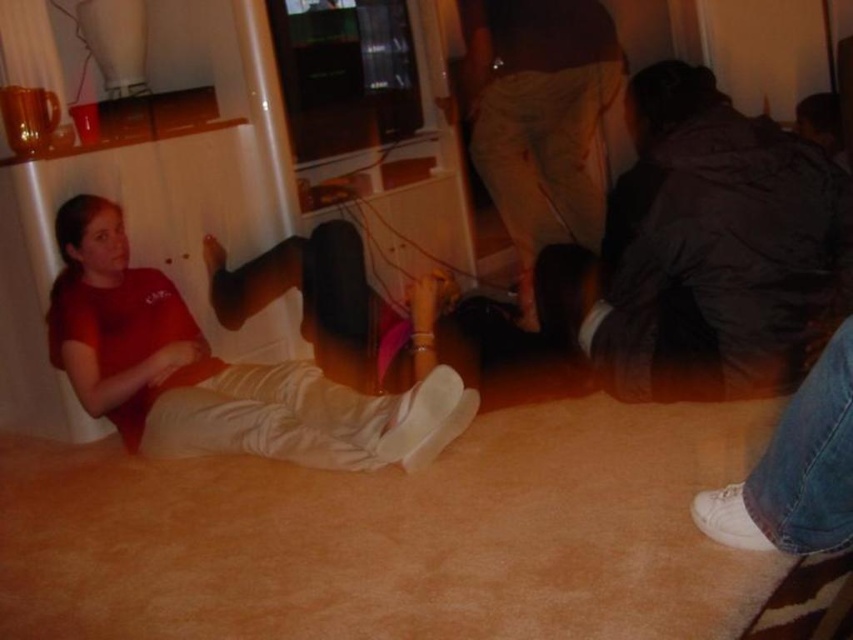
Question: Does dark brown jacket at lower right have a smaller size compared to matte red t-shirt at left?

Choices:
 (A) no
 (B) yes

Answer: (B)

Question: Which is nearer to the light brown cotton pants at center?

Choices:
 (A) matte red t-shirt at left
 (B) dark brown jacket at lower right

Answer: (B)

Question: Based on their relative distances, which object is farther from the dark brown jacket at lower right?

Choices:
 (A) matte red t-shirt at left
 (B) light brown cotton pants at center

Answer: (A)

Question: Can you confirm if matte red t-shirt at left is positioned above light brown cotton pants at center?

Choices:
 (A) yes
 (B) no

Answer: (B)

Question: Is matte red t-shirt at left thinner than light brown cotton pants at center?

Choices:
 (A) yes
 (B) no

Answer: (B)

Question: Estimate the real-world distances between objects in this image. Which object is closer to the light brown cotton pants at center?

Choices:
 (A) dark brown jacket at lower right
 (B) matte red t-shirt at left

Answer: (A)